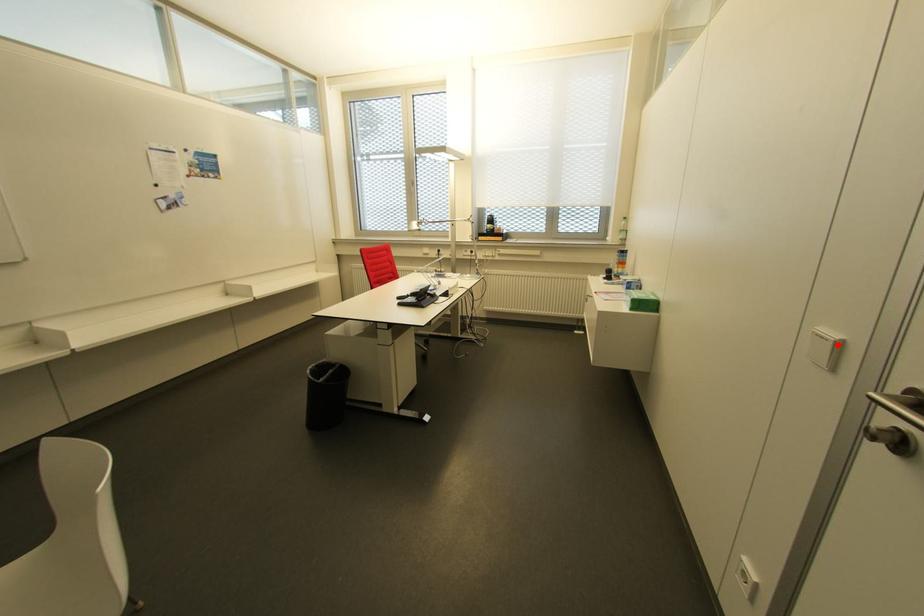
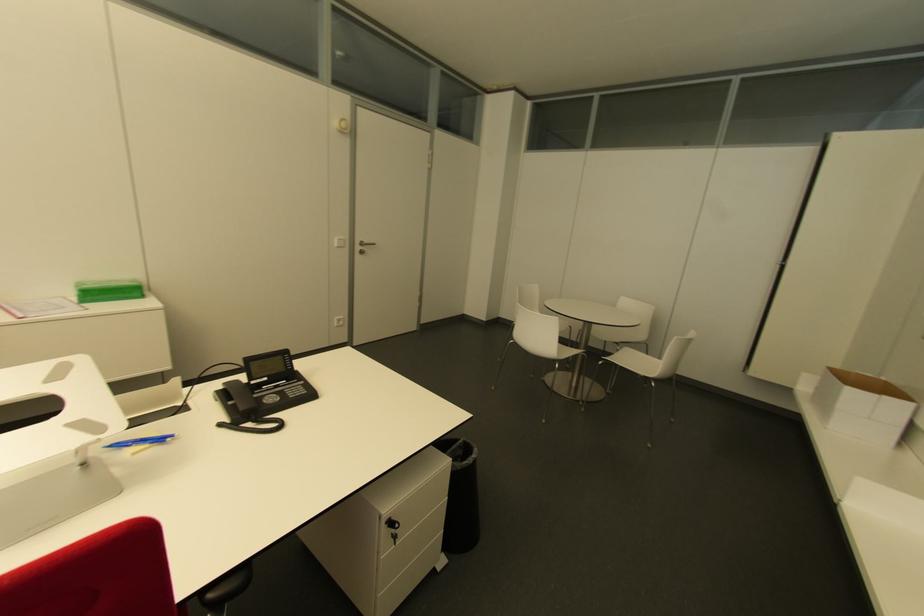
Where in the second image is the point corresponding to the highlighted location from the first image?

(343, 240)